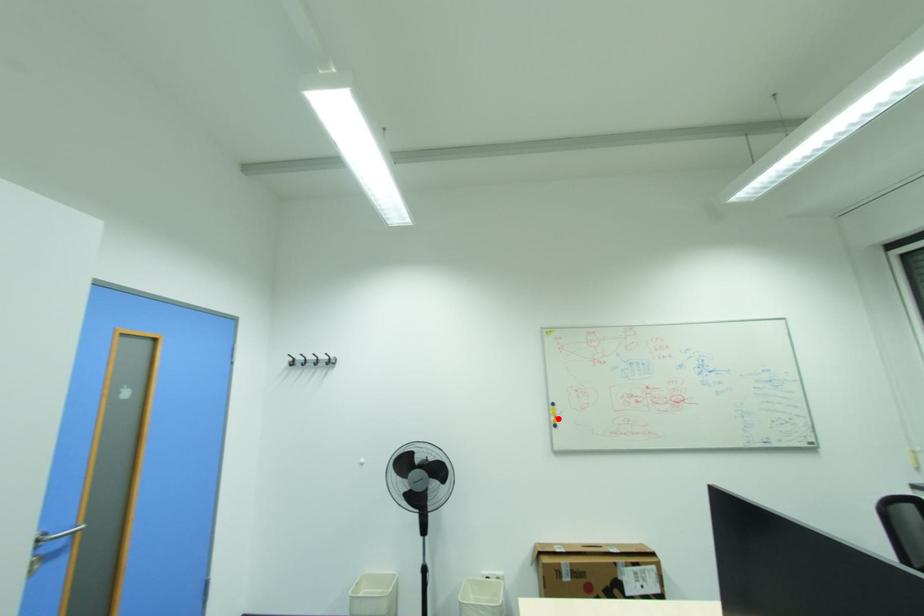
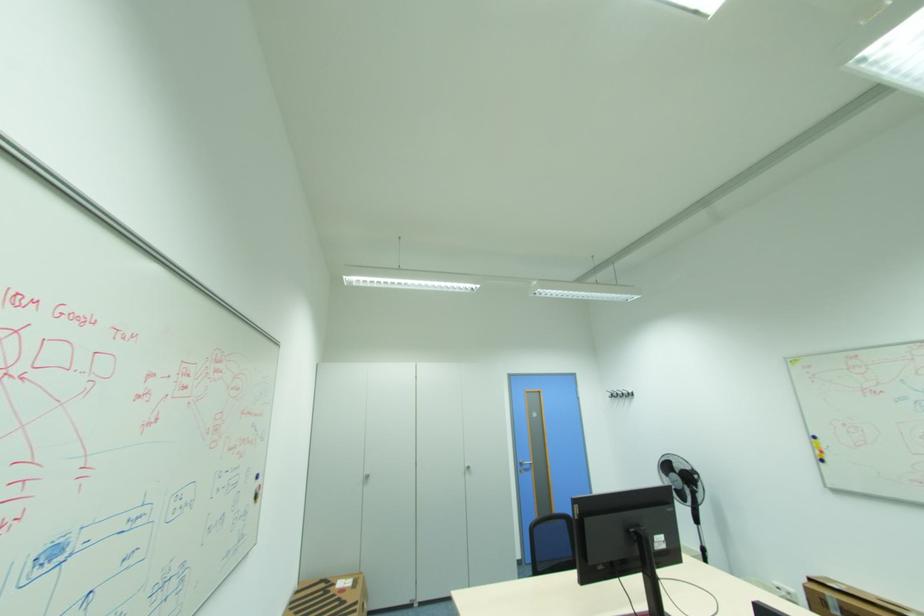
The point at the highlighted location is marked in the first image. Where is the corresponding point in the second image?

(822, 453)